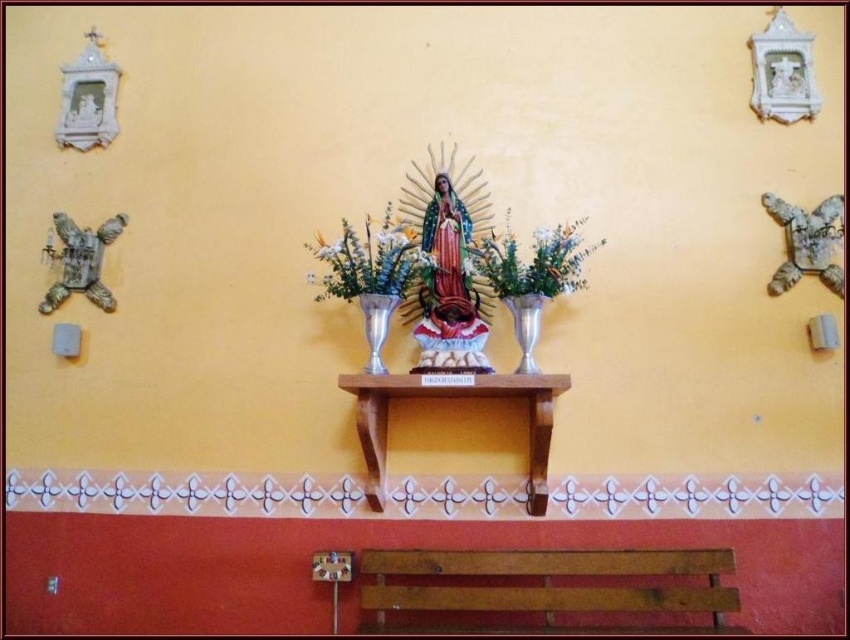
Question: Can you confirm if wooden shelf at center is bigger than matte silver vase at center?

Choices:
 (A) no
 (B) yes

Answer: (B)

Question: Which of these objects is positioned farthest from the green leafy plant at center?

Choices:
 (A) wooden shelf at center
 (B) matte silver vase at center
 (C) silver metallic vase at center
 (D) wooden bench at lower center

Answer: (D)

Question: Which object is farther from the camera taking this photo?

Choices:
 (A) silver metallic vase at center
 (B) matte silver vase at center

Answer: (B)

Question: Can you confirm if green leafy plant at center is positioned to the left of metallic silver vase at center?

Choices:
 (A) no
 (B) yes

Answer: (A)

Question: Which of the following is the farthest from the observer?

Choices:
 (A) wooden bench at lower center
 (B) green leafy plant at center
 (C) matte silver vase at center

Answer: (C)

Question: In this image, where is silver metallic vase at center located relative to metallic silver vase at center?

Choices:
 (A) right
 (B) left

Answer: (A)